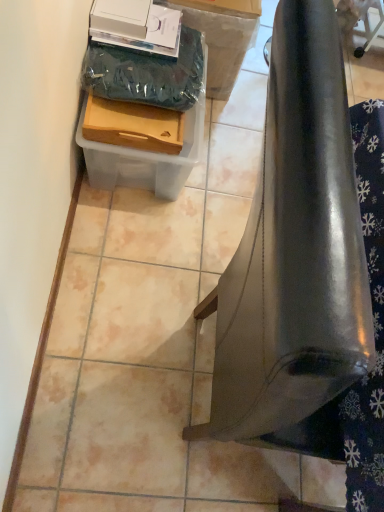
Where is `empty space that is in between glossy metallic bell at lower right and clear plastic container at lower left, placed as the 2th box when sorted from front to back`? empty space that is in between glossy metallic bell at lower right and clear plastic container at lower left, placed as the 2th box when sorted from front to back is located at coordinates (167, 246).